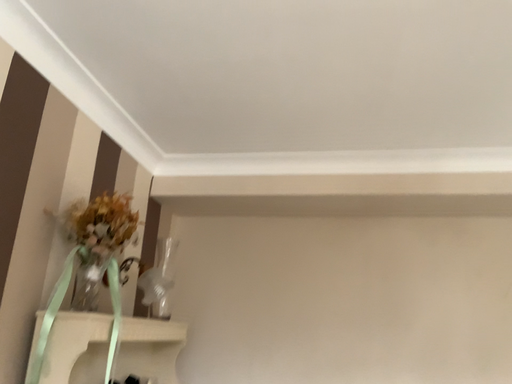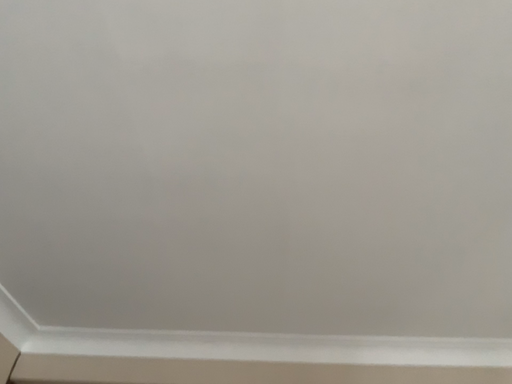
Question: How did the camera likely rotate when shooting the video?

Choices:
 (A) rotated left
 (B) rotated right

Answer: (B)